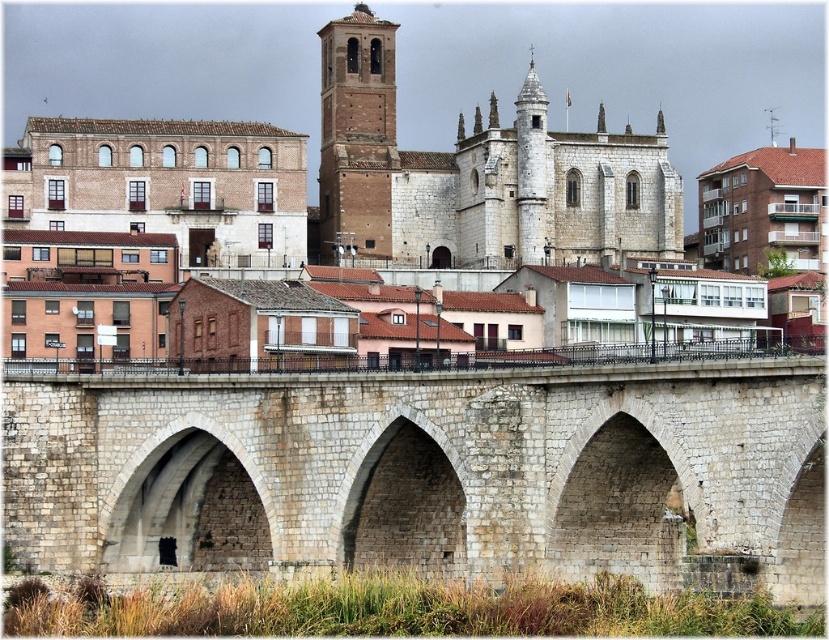
You are standing at the center of the historic town scene. There is a white stone arch at lower left. Where is the white stone arch located in terms of coordinates?

The white stone arch at lower left is located at coordinates point (190,506).

You are standing in the historic town and want to take a photo of the stone bridge and the buildings in the background. You notice two points marked on your map at coordinates point (508, 20) and point (217, 544). Which point is closer to you when you are facing the bridge?

Point (508, 20) is further to the viewer than point (217, 544), so the closer point to you when facing the bridge would be point (217, 544).